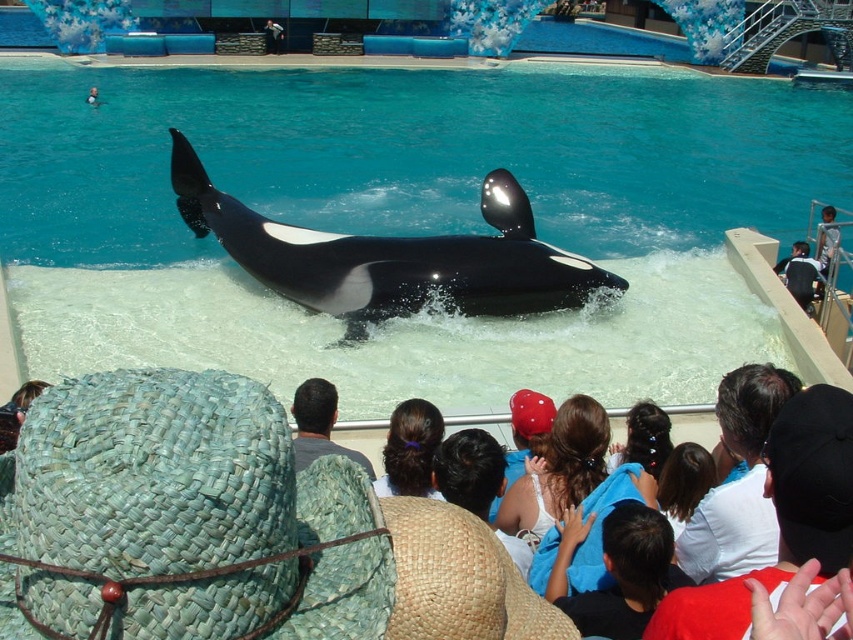
Which is behind, point (491, 109) or point (583, 605)?

Point (491, 109)

Is point (302, 136) positioned before point (566, 518)?

No, (302, 136) is further to viewer.

Who is more distant from viewer, (801,154) or (645,580)?

Point (801,154)

Where is `clear blue water at upper center`? The image size is (853, 640). clear blue water at upper center is located at coordinates (409, 220).

Does blue woven hat at lower center appear over woven straw hat at lower left?

Incorrect, blue woven hat at lower center is not positioned above woven straw hat at lower left.

The height and width of the screenshot is (640, 853). Describe the element at coordinates (618, 570) in the screenshot. I see `blue woven hat at lower center` at that location.

Locate an element on the screen. This screenshot has width=853, height=640. blue woven hat at lower center is located at coordinates (618, 570).

What do you see at coordinates (409, 220) in the screenshot? The width and height of the screenshot is (853, 640). I see `clear blue water at upper center` at bounding box center [409, 220].

Is clear blue water at upper center taller than dark brown hair at center?

Yes, clear blue water at upper center is taller than dark brown hair at center.

Identify the location of clear blue water at upper center. (409, 220).

The width and height of the screenshot is (853, 640). I want to click on clear blue water at upper center, so click(x=409, y=220).